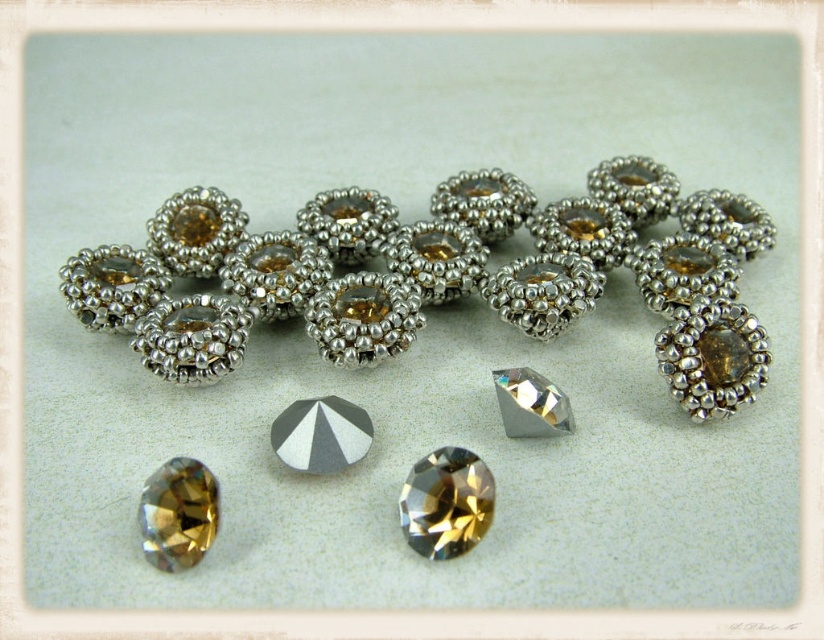
Question: Does silver metallic beads at center have a larger size compared to matte gold diamond at center?

Choices:
 (A) yes
 (B) no

Answer: (A)

Question: Which point is farther to the camera?

Choices:
 (A) (647, 248)
 (B) (515, 385)
 (C) (476, 524)
 (D) (176, 544)

Answer: (A)

Question: Can you confirm if silver metallic beads at center is positioned to the left of metallic silver diamond at center?

Choices:
 (A) yes
 (B) no

Answer: (B)

Question: Among these points, which one is nearest to the camera?

Choices:
 (A) (190, 472)
 (B) (92, 304)

Answer: (A)

Question: Does matte gold diamond at center appear under clear crystal diamond at center?

Choices:
 (A) yes
 (B) no

Answer: (A)

Question: Among these objects, which one is farthest from the camera?

Choices:
 (A) clear crystal diamond at center
 (B) silver metallic beads at center
 (C) faceted gold diamond at center
 (D) metallic silver diamond at center

Answer: (B)